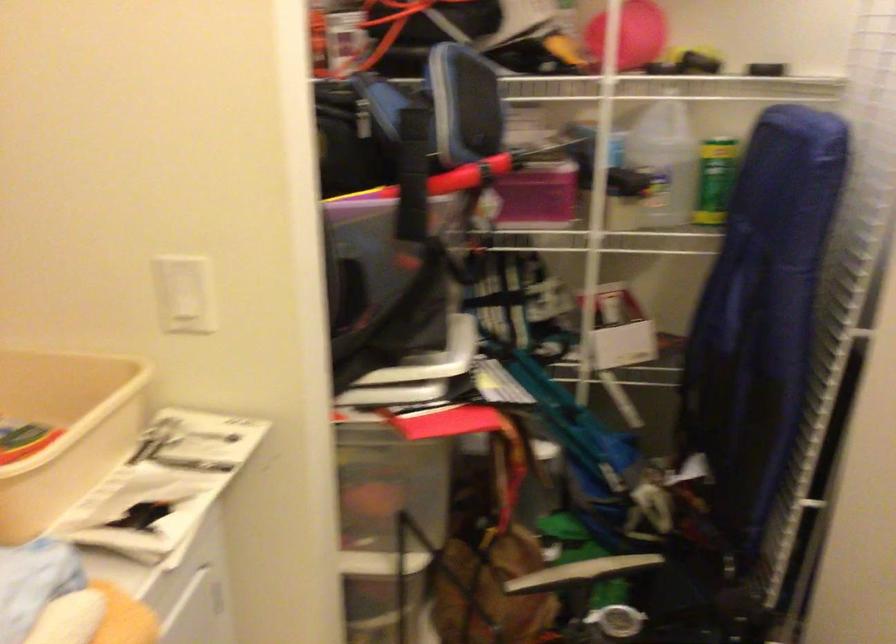
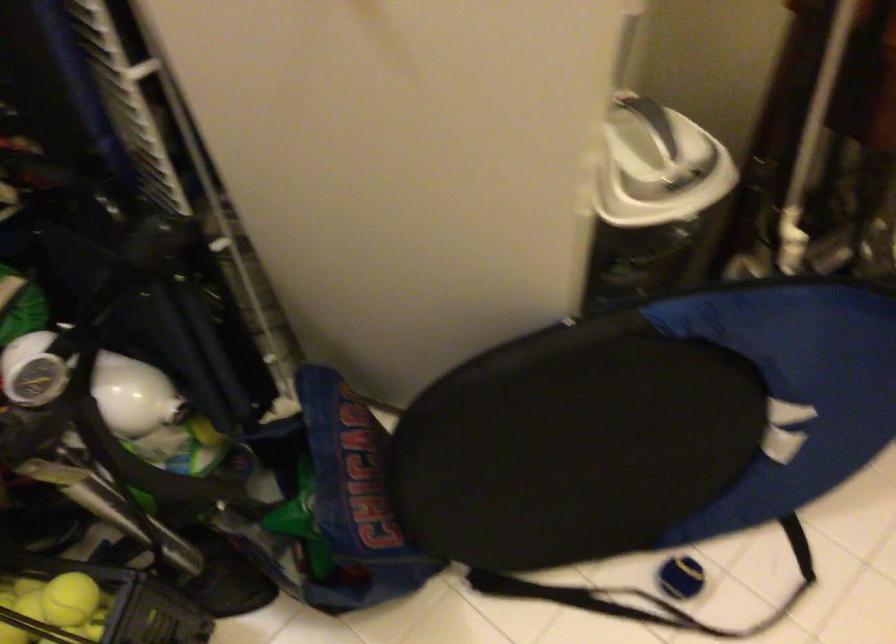
From the picture: Based on the continuous images, in which direction is the camera rotating?

The camera rotated toward right-down.